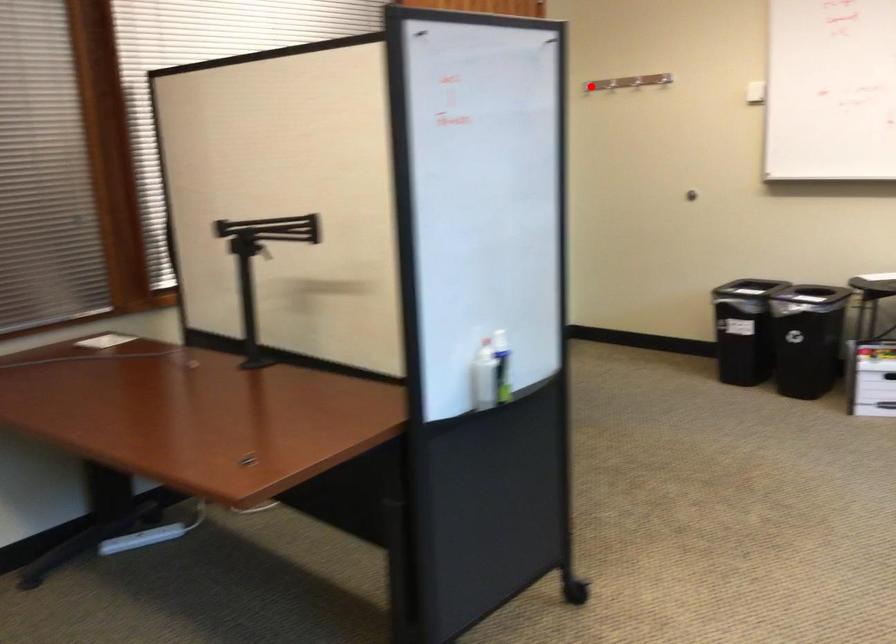
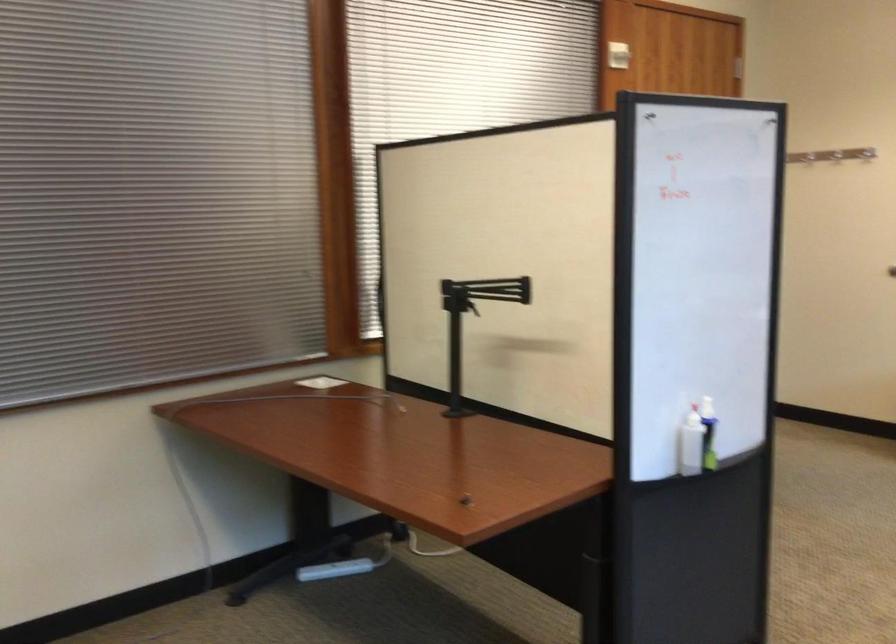
Question: I am providing you with two images of the same scene from different viewpoints. A red point is marked on the first image. Is the red point's position out of view in image 2?

Choices:
 (A) Yes
 (B) No

Answer: (A)